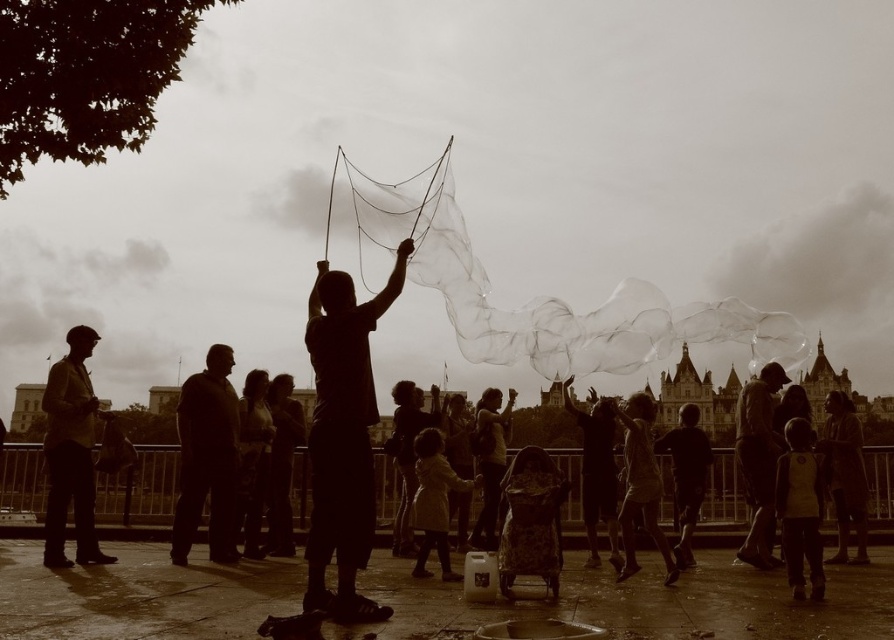
You are a photographer standing in the scene and want to take a photo of the dark gray hoodie at center and the matte white dress at center. Which one will be in focus if you focus on the foreground?

The dark gray hoodie at center will be in focus because it is in the foreground, while the matte white dress at center is behind it and thus further away.

You are a photographer trying to capture the perfect shot of the dark gray hoodie at center and the matte white dress at center. Which one should you focus on first if you want to ensure both are in focus without adjusting the camera settings?

The dark gray hoodie at center is taller than the matte white dress at center, so focusing on the dark gray hoodie at center first would ensure both are within the depth of field since it is closer to the camera.

You are a photographer standing at the edge of the scene. You want to take a photo that includes both the dark gray hoodie at center and the matte white dress at center. What is the minimum distance you need to move backward to ensure both subjects are fully in frame?

The minimum distance you need to move backward is 54.72 feet to ensure both the dark gray hoodie at center and the matte white dress at center are fully in frame.